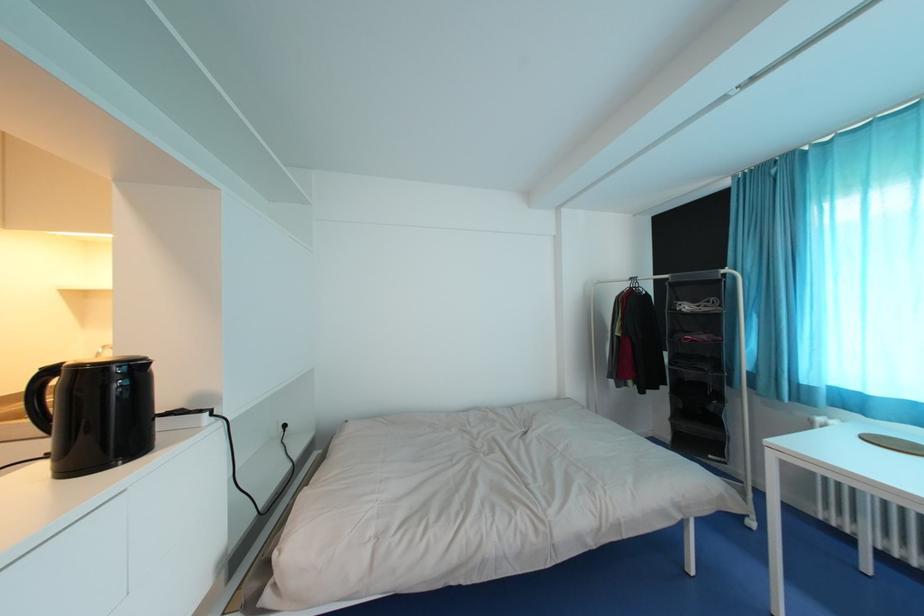
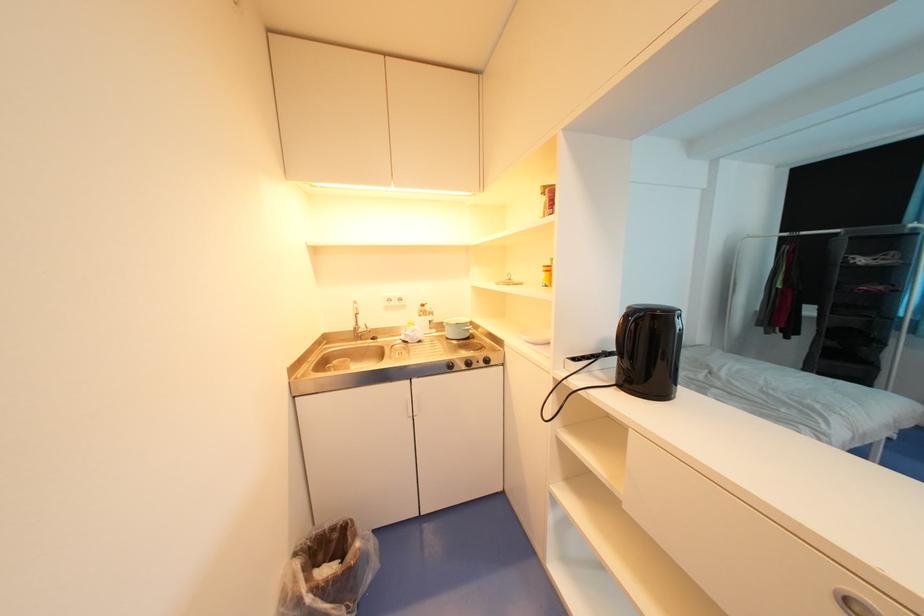
Question: What movement of the cameraman would produce the second image?

Choices:
 (A) Left
 (B) Right
 (C) Forward
 (D) Backward

Answer: (A)